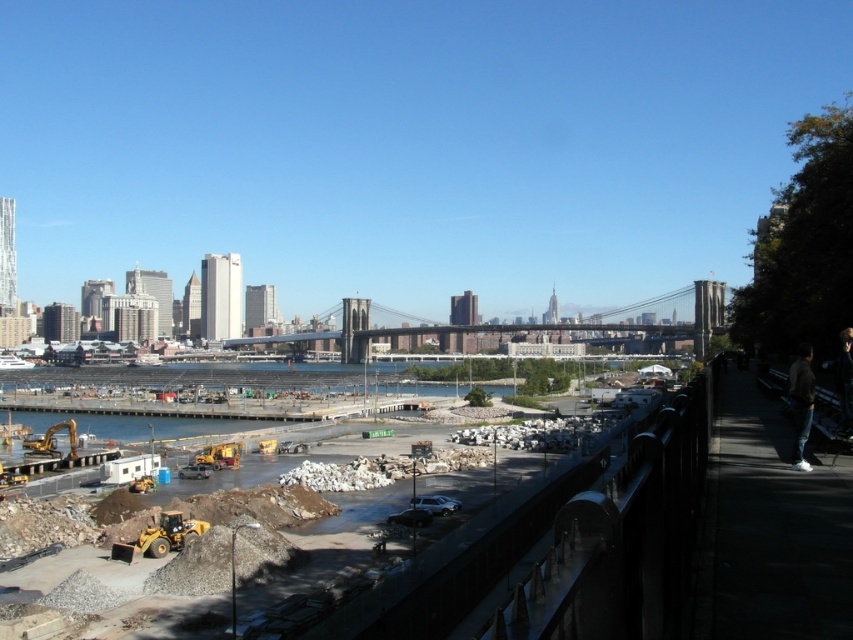
You are an architect observing the cityscape and need to determine the spatial relationship between the metallic gray bridge at center and the dark gray hoodie at right. Which object is closer to you?

The metallic gray bridge at center is closer to you than the dark gray hoodie at right because it is positioned further to the viewer.

You are a drone operator tasked with capturing aerial footage of the metallic gray bridge at center. Your drone has a maximum flight range of 350 meters. Based on the scene, can your drone safely reach the bridge without exceeding its range?

The metallic gray bridge at center is 366.64 meters away from the viewer. Since the drone has a maximum flight range of 350 meters, it cannot safely reach the bridge without exceeding its range.